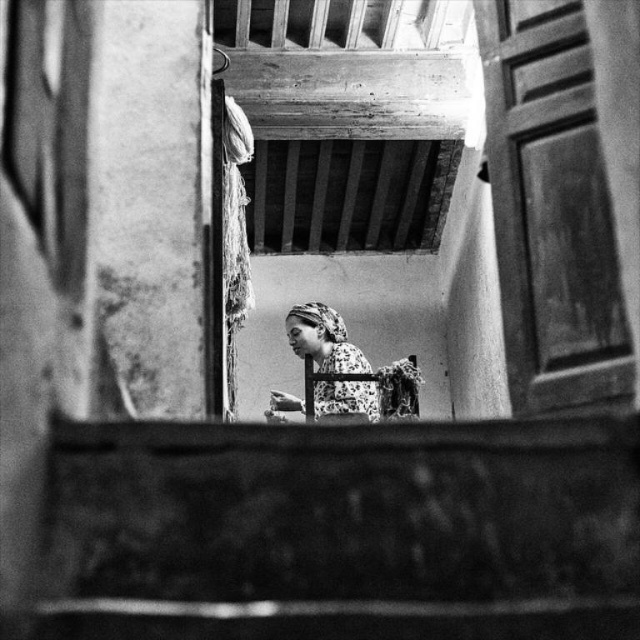
Is point (92, 604) closer to camera compared to point (296, 328)?

Yes, it is in front of point (296, 328).

Where is `smooth concrete stairs at lower center`? smooth concrete stairs at lower center is located at coordinates (342, 531).